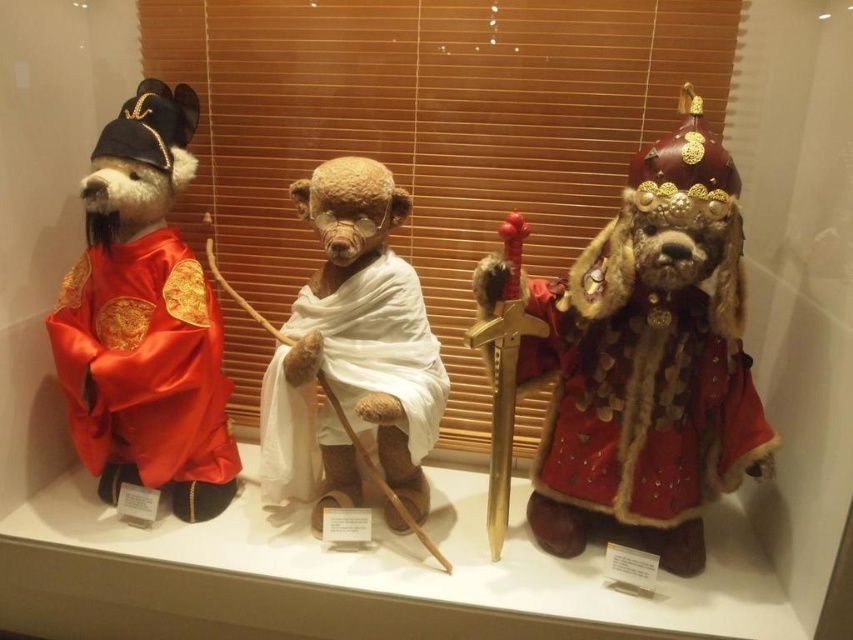
Question: Does fuzzy red coat at center appear under white cotton cloth at center?

Choices:
 (A) yes
 (B) no

Answer: (B)

Question: Which object is the closest to the fuzzy red coat at center?

Choices:
 (A) white cotton cloth at center
 (B) silky red robe at left
 (C) velvet red bear at center

Answer: (C)

Question: Does fuzzy red coat at center have a larger size compared to white cotton cloth at center?

Choices:
 (A) yes
 (B) no

Answer: (A)

Question: Does fuzzy red coat at center appear under white cotton cloth at center?

Choices:
 (A) yes
 (B) no

Answer: (B)

Question: Based on their relative distances, which object is farther from the fuzzy red coat at center?

Choices:
 (A) velvet red bear at center
 (B) silky red robe at left

Answer: (B)

Question: Based on their relative distances, which object is nearer to the velvet red bear at center?

Choices:
 (A) white cotton cloth at center
 (B) fuzzy red coat at center

Answer: (B)